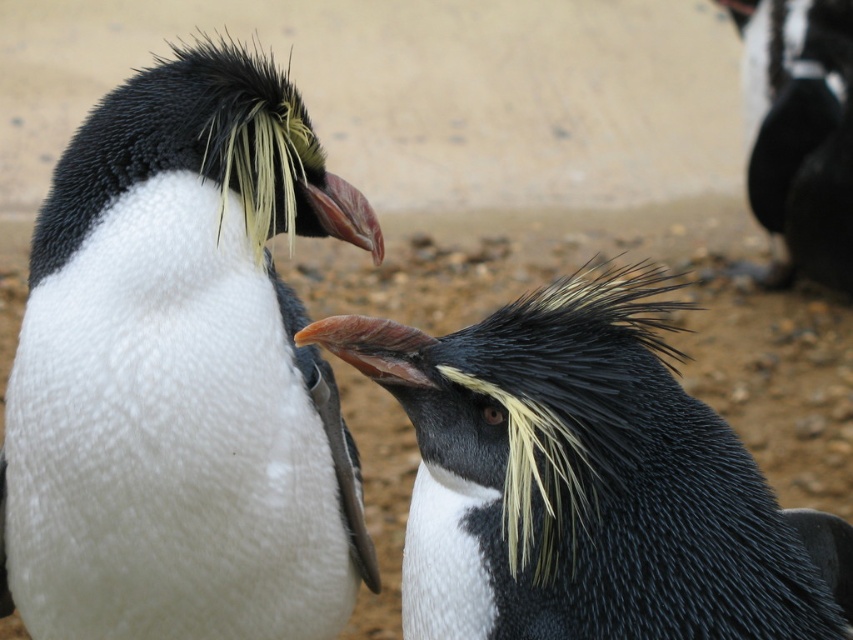
Question: Can you confirm if white soft penguin at left is positioned above black matte penguin at upper right?

Choices:
 (A) no
 (B) yes

Answer: (A)

Question: Can you confirm if white soft penguin at left is positioned to the left of black and white feathers at center?

Choices:
 (A) yes
 (B) no

Answer: (A)

Question: Which of the following is the farthest from the observer?

Choices:
 (A) black matte penguin at upper right
 (B) white soft penguin at left
 (C) black and white feathers at center

Answer: (A)

Question: Does white soft penguin at left have a greater width compared to black and white feathers at center?

Choices:
 (A) yes
 (B) no

Answer: (A)

Question: Which point is closer to the camera taking this photo?

Choices:
 (A) (840, 4)
 (B) (99, 252)

Answer: (B)

Question: Which of the following is the farthest from the observer?

Choices:
 (A) (793, 230)
 (B) (563, 620)

Answer: (A)